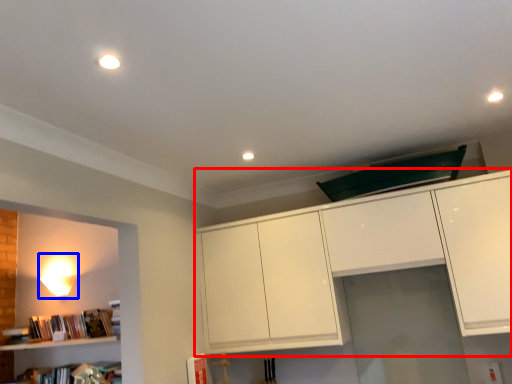
Question: Which of the following is the farthest to the observer, cabinetry (highlighted by a red box) or lamp (highlighted by a blue box)?

Choices:
 (A) cabinetry
 (B) lamp

Answer: (B)